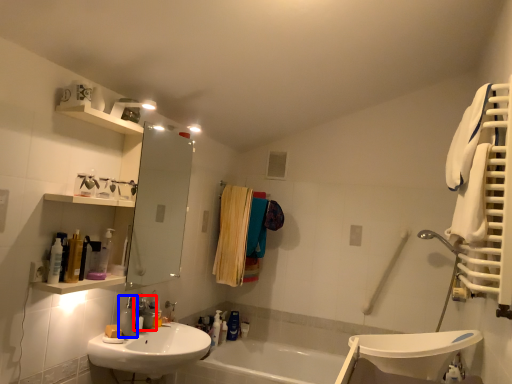
Question: Which object is closer to the camera taking this photo, plumbing fixture (highlighted by a red box) or soap dispenser (highlighted by a blue box)?

Choices:
 (A) plumbing fixture
 (B) soap dispenser

Answer: (B)